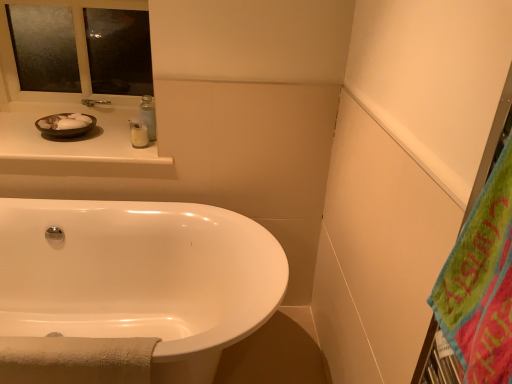
In order to face matte black bowl at upper left, should I rotate leftwards or rightwards?

You should rotate left by 23.526 degrees.

In order to face matte white counter at upper left, should I rotate leftwards or rightwards?

A 22.929 degree turn to the left will do.

The height and width of the screenshot is (384, 512). What are the coordinates of `white glossy lotion at upper center` in the screenshot? It's located at (138, 134).

From a real-world perspective, is white glossy bathtub at lower left physically located above or below frosted glass mirror at upper left?

Clearly, from a real-world perspective, white glossy bathtub at lower left is below frosted glass mirror at upper left.

Consider the image. Is white glossy bathtub at lower left taller than frosted glass mirror at upper left?

Yes, white glossy bathtub at lower left is taller than frosted glass mirror at upper left.

Which of these two, white glossy bathtub at lower left or frosted glass mirror at upper left, is thinner?

With smaller width is frosted glass mirror at upper left.

From the image's perspective, relative to frosted glass mirror at upper left, is white glossy bathtub at lower left above or below?

Based on their image positions, white glossy bathtub at lower left is located beneath frosted glass mirror at upper left.

Image resolution: width=512 pixels, height=384 pixels. I want to click on beach towel in front of the matte white counter at upper left, so click(481, 283).

Which is closer to the camera, (493, 333) or (54, 158)?

Point (493, 333) is positioned closer to the camera compared to point (54, 158).

Which is more to the right, green fuzzy beach towel at right or matte white counter at upper left?

Positioned to the right is green fuzzy beach towel at right.

Is point (64, 131) positioned after point (470, 359)?

That is True.

Identify the location of sink that appears on the left of green fuzzy beach towel at right. (64, 130).

Between matte black bowl at upper left and green fuzzy beach towel at right, which one is positioned in front?

Positioned in front is green fuzzy beach towel at right.

From the image's perspective, between matte black bowl at upper left and green fuzzy beach towel at right, who is located below?

green fuzzy beach towel at right is shown below in the image.

In terms of height, does white glossy lotion at upper center look taller or shorter compared to matte black bowl at upper left?

white glossy lotion at upper center is taller than matte black bowl at upper left.

Can you tell me how much white glossy lotion at upper center and matte black bowl at upper left differ in facing direction?

The angle between the facing direction of white glossy lotion at upper center and the facing direction of matte black bowl at upper left is 6.94 degrees.

Choose the correct answer: Is white glossy lotion at upper center inside matte black bowl at upper left or outside it?

white glossy lotion at upper center cannot be found inside matte black bowl at upper left.

From a real-world perspective, who is located lower, white glossy lotion at upper center or matte black bowl at upper left?

In real-world perspective, matte black bowl at upper left is lower.

Find the location of a particular element. mirror above the matte black bowl at upper left (from a real-world perspective) is located at coordinates (76, 47).

From the image's perspective, between frosted glass mirror at upper left and matte black bowl at upper left, who is located below?

From the image's view, matte black bowl at upper left is below.

Does frosted glass mirror at upper left lie in front of matte black bowl at upper left?

No, it is not.

From the image's perspective, is matte black bowl at upper left over white glossy lotion at upper center?

Yes, from the image's perspective, matte black bowl at upper left is over white glossy lotion at upper center.

Which is more to the left, matte black bowl at upper left or white glossy lotion at upper center?

Positioned to the left is matte black bowl at upper left.

I want to click on toiletry below the matte black bowl at upper left (from the image's perspective), so click(x=138, y=134).

Is green fuzzy beach towel at right next to white glossy bathtub at lower left and touching it?

green fuzzy beach towel at right is not next to white glossy bathtub at lower left, and they're not touching.

From the image's perspective, is green fuzzy beach towel at right over white glossy bathtub at lower left?

Yes, from the image's perspective, green fuzzy beach towel at right is on top of white glossy bathtub at lower left.

Measure the distance from green fuzzy beach towel at right to white glossy bathtub at lower left.

green fuzzy beach towel at right is 1.14 meters from white glossy bathtub at lower left.

Would you say green fuzzy beach towel at right is inside or outside white glossy bathtub at lower left?

green fuzzy beach towel at right is spatially situated outside white glossy bathtub at lower left.

Locate an element on the screen. This screenshot has height=384, width=512. bathtub directly beneath the frosted glass mirror at upper left (from a real-world perspective) is located at coordinates (139, 277).

Locate an element on the screen. This screenshot has width=512, height=384. beach towel on the right of matte white counter at upper left is located at coordinates (481, 283).

Consider the image. When comparing their distances from white glossy lotion at upper center, does frosted glass mirror at upper left or green fuzzy beach towel at right seem closer?

frosted glass mirror at upper left.

Considering their positions, is matte white counter at upper left positioned further to white glossy lotion at upper center than matte black bowl at upper left?

Among the two, matte white counter at upper left is located further to white glossy lotion at upper center.

From the image, which object appears to be farther from green fuzzy beach towel at right, frosted glass mirror at upper left or white glossy lotion at upper center?

frosted glass mirror at upper left is further to green fuzzy beach towel at right.

Considering their positions, is white glossy bathtub at lower left positioned closer to green fuzzy beach towel at right than matte black bowl at upper left?

The object closer to green fuzzy beach towel at right is white glossy bathtub at lower left.

From the image, which object appears to be farther from matte white counter at upper left, green fuzzy beach towel at right or white glossy lotion at upper center?

The object further to matte white counter at upper left is green fuzzy beach towel at right.

Estimate the real-world distances between objects in this image. Which object is further from matte white counter at upper left, white glossy bathtub at lower left or green fuzzy beach towel at right?

green fuzzy beach towel at right is positioned further to the anchor matte white counter at upper left.

From the image, which object appears to be nearer to white glossy lotion at upper center, frosted glass mirror at upper left or white glossy bathtub at lower left?

Among the two, frosted glass mirror at upper left is located nearer to white glossy lotion at upper center.

From the image, which object appears to be farther from green fuzzy beach towel at right, frosted glass mirror at upper left or white glossy bathtub at lower left?

frosted glass mirror at upper left lies further to green fuzzy beach towel at right than the other object.

Where is `counter top between frosted glass mirror at upper left and white glossy bathtub at lower left vertically`? The height and width of the screenshot is (384, 512). counter top between frosted glass mirror at upper left and white glossy bathtub at lower left vertically is located at coordinates (75, 138).

At what (x,y) coordinates should I click in order to perform the action: click on counter top located between green fuzzy beach towel at right and white glossy lotion at upper center in the depth direction. Please return your answer as a coordinate pair (x, y). This screenshot has height=384, width=512. Looking at the image, I should click on (75, 138).

Identify the location of toiletry between green fuzzy beach towel at right and matte black bowl at upper left from front to back. The image size is (512, 384). (138, 134).

This screenshot has height=384, width=512. I want to click on counter top located between matte black bowl at upper left and white glossy lotion at upper center in the left-right direction, so click(x=75, y=138).